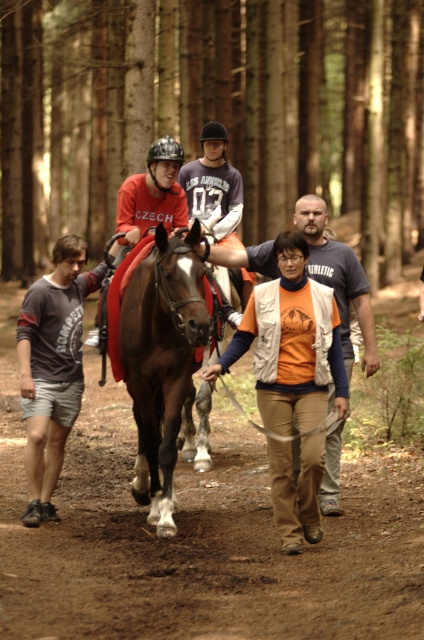
Is gray cotton t-shirt at lower left to the right of orange cotton t-shirt at center from the viewer's perspective?

No, gray cotton t-shirt at lower left is not to the right of orange cotton t-shirt at center.

Does gray cotton t-shirt at lower left have a greater height compared to orange cotton t-shirt at center?

Yes, gray cotton t-shirt at lower left is taller than orange cotton t-shirt at center.

You are a GUI agent. You are given a task and a screenshot of the screen. Output one action in this format:
    pyautogui.click(x=<x>, y=<y>)
    Task: Click on the gray cotton t-shirt at lower left
    
    Given the screenshot: What is the action you would take?
    pyautogui.click(x=53, y=365)

Where is `gray cotton t-shirt at lower left`? The image size is (424, 640). gray cotton t-shirt at lower left is located at coordinates (53, 365).

Who is positioned more to the left, gray cotton t-shirt at lower left or matte red saddle at center?

gray cotton t-shirt at lower left

Can you confirm if gray cotton t-shirt at lower left is wider than matte red saddle at center?

Indeed, gray cotton t-shirt at lower left has a greater width compared to matte red saddle at center.

Is point (33, 486) closer to camera compared to point (125, 196)?

Yes, it is.

Locate an element on the screen. The height and width of the screenshot is (640, 424). gray cotton t-shirt at lower left is located at coordinates pyautogui.click(x=53, y=365).

Does brown wood pine forest at center lie behind matte red saddle at center?

Yes, it is.

Between point (125, 8) and point (186, 211), which one is positioned behind?

The point (125, 8) is behind.

You are a GUI agent. You are given a task and a screenshot of the screen. Output one action in this format:
    pyautogui.click(x=<x>, y=<y>)
    Task: Click on the brown wood pine forest at center
    
    Given the screenshot: What is the action you would take?
    pyautogui.click(x=212, y=113)